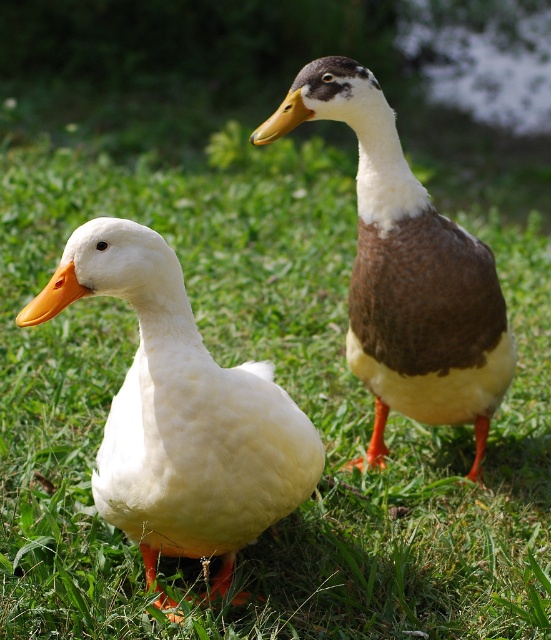
Question: Does white matte duck at left come behind brown matte duck at upper right?

Choices:
 (A) yes
 (B) no

Answer: (B)

Question: From the image, what is the correct spatial relationship of white matte duck at left in relation to brown matte duck at upper right?

Choices:
 (A) right
 (B) left

Answer: (B)

Question: Among these points, which one is farthest from the camera?

Choices:
 (A) (196, 531)
 (B) (480, 440)

Answer: (B)

Question: Is white matte duck at left to the left of brown matte duck at upper right from the viewer's perspective?

Choices:
 (A) yes
 (B) no

Answer: (A)

Question: Which point is closer to the camera?

Choices:
 (A) (159, 403)
 (B) (271, 122)

Answer: (A)